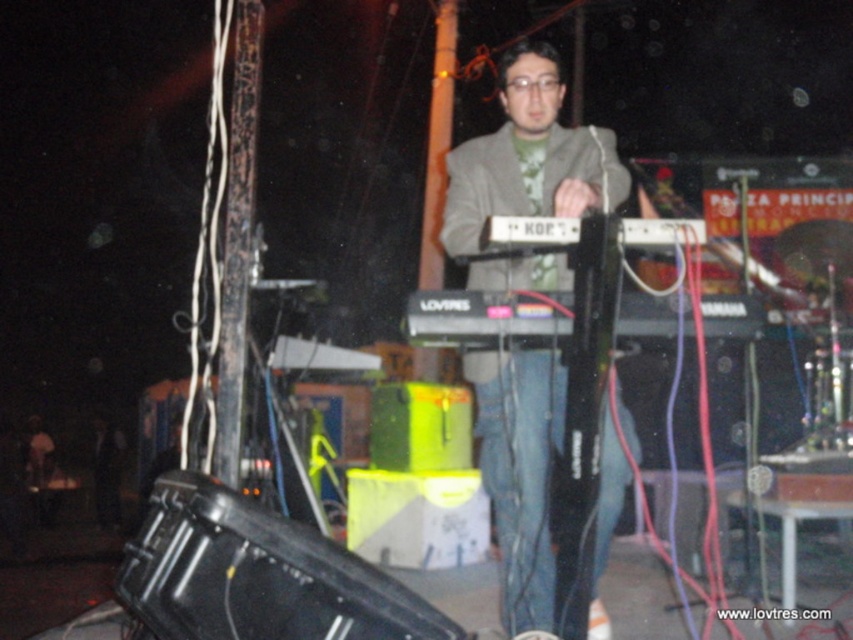
You are a stagehand who needs to adjust the lighting on the black plastic keyboard at center. To avoid casting a shadow on it, you must position the light so it doesn not shine on the matte gray jacket at center. Based on their positions, which side of the keyboard should you place the light?

The matte gray jacket at center is to the left of the black plastic keyboard at center, so placing the light to the right side of the keyboard would avoid shining on the jacket and casting a shadow on the keyboard.

You are standing at the center of the stage and want to move towards the keyboard labeled LOVRES. There are two points marked on the stage floor, one at point coordinates (598, 198) and another at (500, 314). Which point should you step on first to reach the keyboard more quickly?

Point (500, 314) is closer to you than point (598, 198), so stepping on point (500, 314) first will allow you to reach the keyboard more quickly.